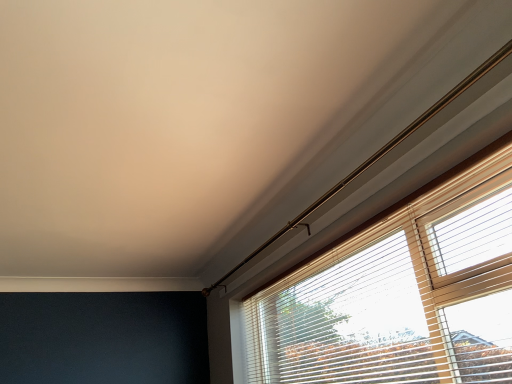
Find the location of a particular element. wooden blinds at upper right is located at coordinates (400, 295).

Image resolution: width=512 pixels, height=384 pixels. Describe the element at coordinates (400, 295) in the screenshot. I see `wooden blinds at upper right` at that location.

Identify the location of wooden blinds at upper right. This screenshot has width=512, height=384. (400, 295).